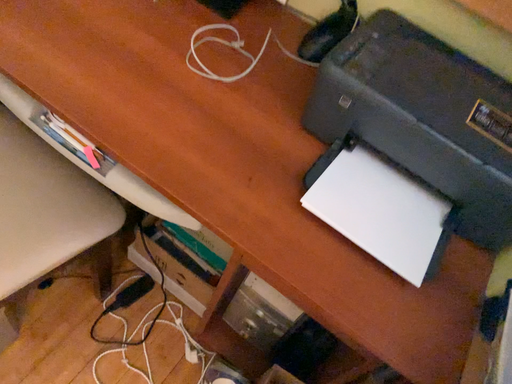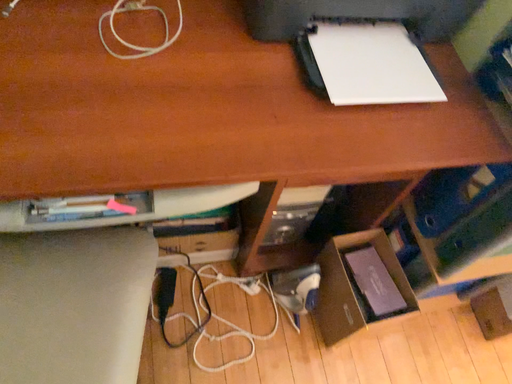
Question: How did the camera likely rotate when shooting the video?

Choices:
 (A) rotated downward
 (B) rotated upward

Answer: (A)